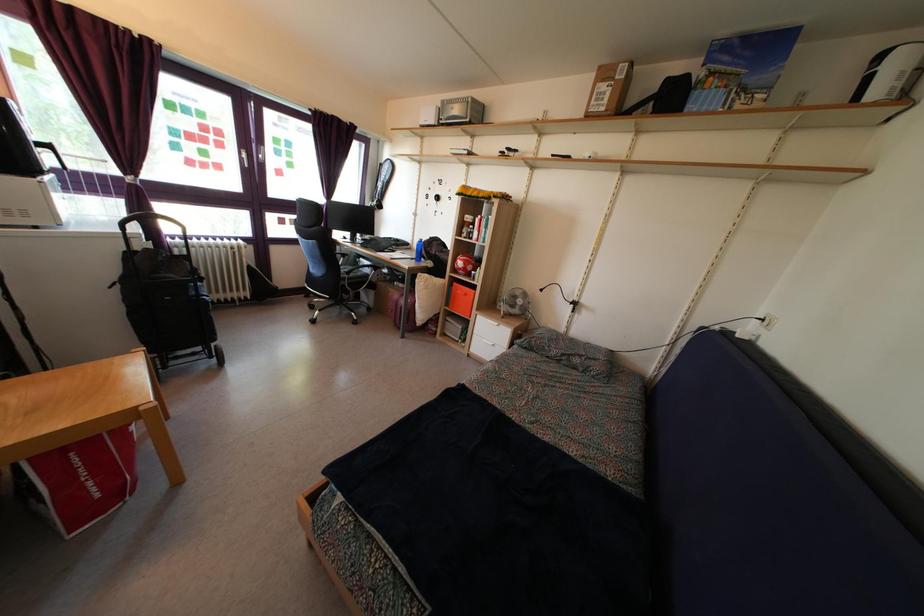
Describe the element at coordinates (261, 153) in the screenshot. I see `the white window handle` at that location.